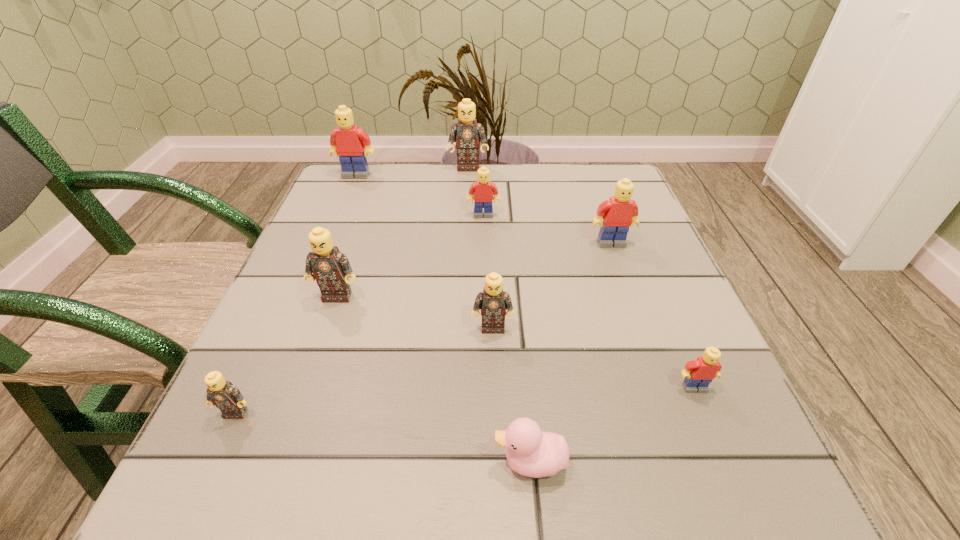
Where is `vacant area between the smallest yellow Lego and the duckling`? The height and width of the screenshot is (540, 960). vacant area between the smallest yellow Lego and the duckling is located at coordinates (612, 425).

Find the location of a particular element. The image size is (960, 540). unoccupied position between the third farthest Lego and the smallest yellow Lego is located at coordinates (x=588, y=301).

You are a GUI agent. You are given a task and a screenshot of the screen. Output one action in this format:
    pyautogui.click(x=<x>, y=<y>)
    Task: Click on the object that can be found as the closest to the third biggest yellow Lego
    
    Given the screenshot: What is the action you would take?
    pyautogui.click(x=469, y=133)

At what (x,y) coordinates should I click in order to perform the action: click on object that is the seventh nearest to the farthest tan Lego. Please return your answer as a coordinate pair (x, y). The image size is (960, 540). Looking at the image, I should click on (227, 397).

In order to click on the second closest Lego relative to the third farthest yellow Lego in this screenshot , I will do `click(493, 302)`.

I want to click on Lego that stands as the closest to the biggest yellow Lego, so click(x=469, y=133).

Locate which yellow Lego ranks in proximity to the nearest Lego. Please provide its 2D coordinates. Your answer should be formatted as a tuple, i.e. [(x, y)], where the tuple contains the x and y coordinates of a point satisfying the conditions above.

[(482, 191)]

At what (x,y) coordinates should I click in order to perform the action: click on yellow Lego that stands as the closest to the third nearest Lego. Please return your answer as a coordinate pair (x, y). The height and width of the screenshot is (540, 960). Looking at the image, I should click on (699, 373).

Locate an element on the screen. the third closest tan Lego to the third nearest yellow Lego is located at coordinates point(493,302).

The height and width of the screenshot is (540, 960). Find the location of `tan Lego that stands as the third closest to the third nearest tan Lego`. tan Lego that stands as the third closest to the third nearest tan Lego is located at coordinates (469, 133).